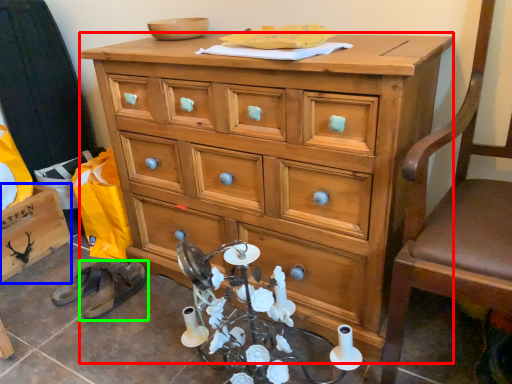
Question: Considering the real-world distances, which object is farthest from chest of drawers (highlighted by a red box)? cabinetry (highlighted by a blue box) or footwear (highlighted by a green box)?

Choices:
 (A) cabinetry
 (B) footwear

Answer: (A)